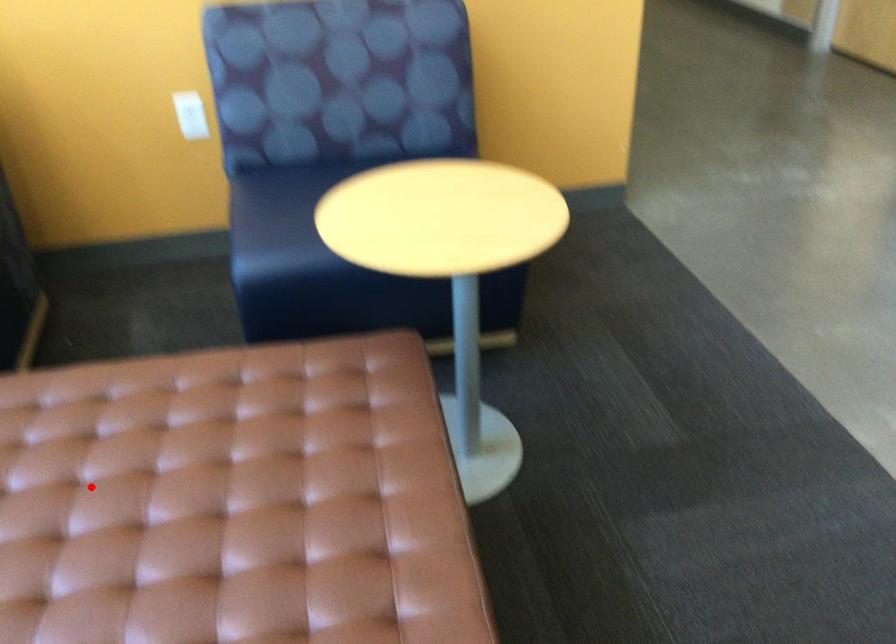
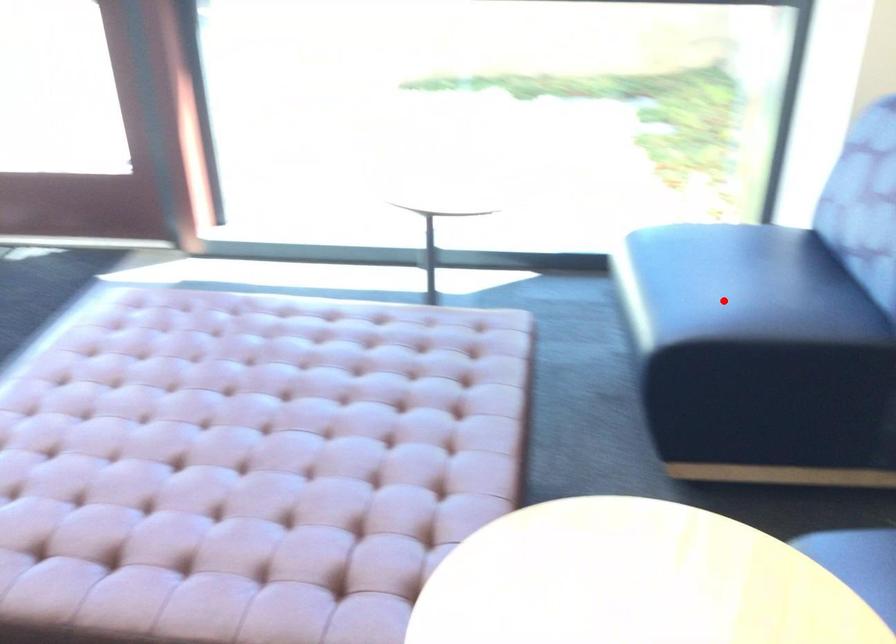
I am providing you with two images of the same scene from different viewpoints. A red point is marked on the first image and another point is marked on the second image. Does the point marked in image1 correspond to the same location as the one in image2?

No